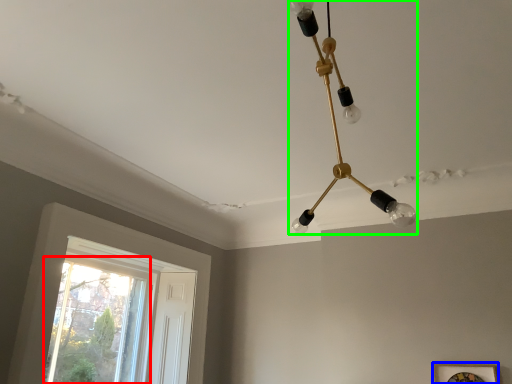
Question: Based on their relative distances, which object is farther from window (highlighted by a red box)? Choose from picture frame (highlighted by a blue box) and lamp (highlighted by a green box).

Choices:
 (A) picture frame
 (B) lamp

Answer: (B)